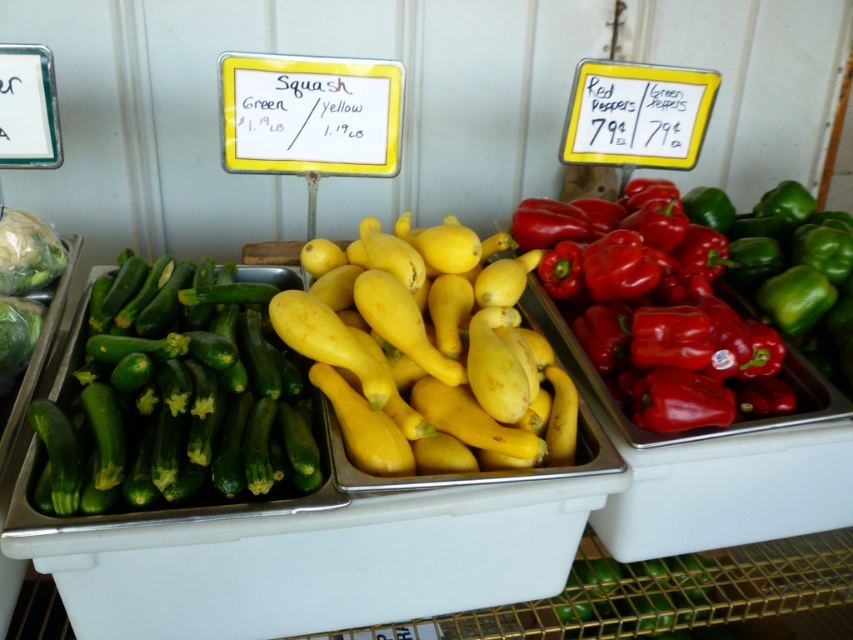
Between point (474, 336) and point (294, 429), which one is positioned behind?

The point (474, 336) is behind.

Is yellow matte squash at center below green smooth zucchini at left?

No, yellow matte squash at center is not below green smooth zucchini at left.

Is point (372, 257) positioned before point (268, 419)?

No, it is not.

You are a GUI agent. You are given a task and a screenshot of the screen. Output one action in this format:
    pyautogui.click(x=<x>, y=<y>)
    Task: Click on the yellow matte squash at center
    
    Given the screenshot: What is the action you would take?
    pyautogui.click(x=428, y=353)